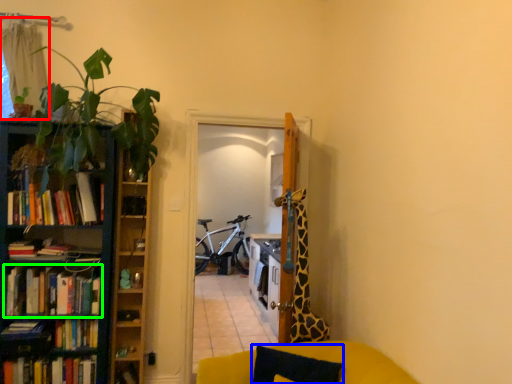
Question: Which is farther away from curtain (highlighted by a red box)? pillow (highlighted by a blue box) or book (highlighted by a green box)?

Choices:
 (A) pillow
 (B) book

Answer: (A)